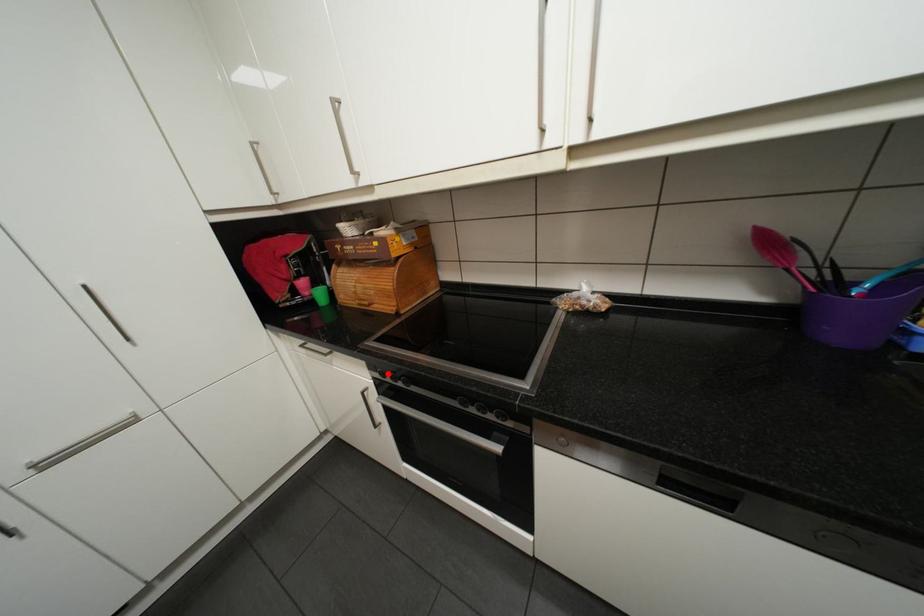
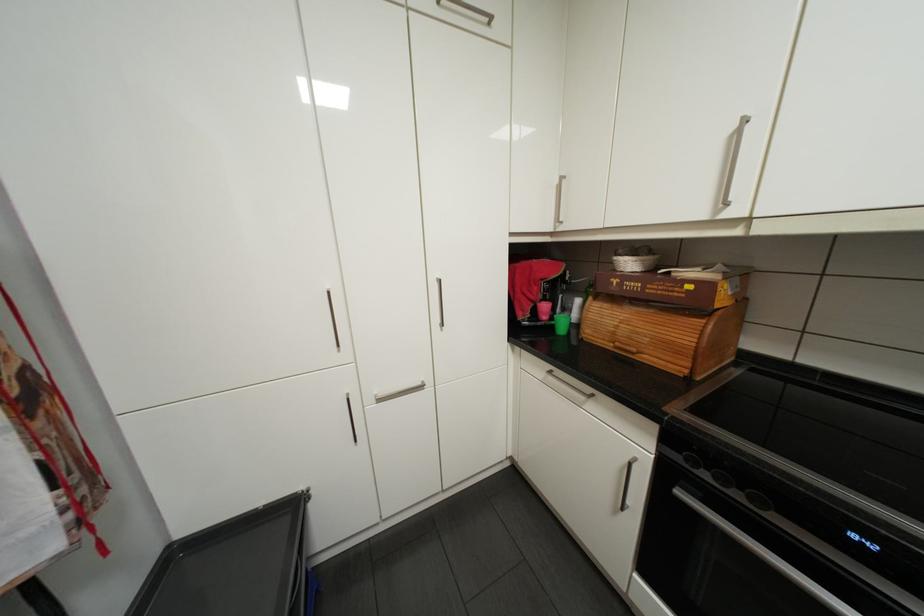
In the second image, find the point that corresponds to the highlighted location in the first image.

(695, 459)